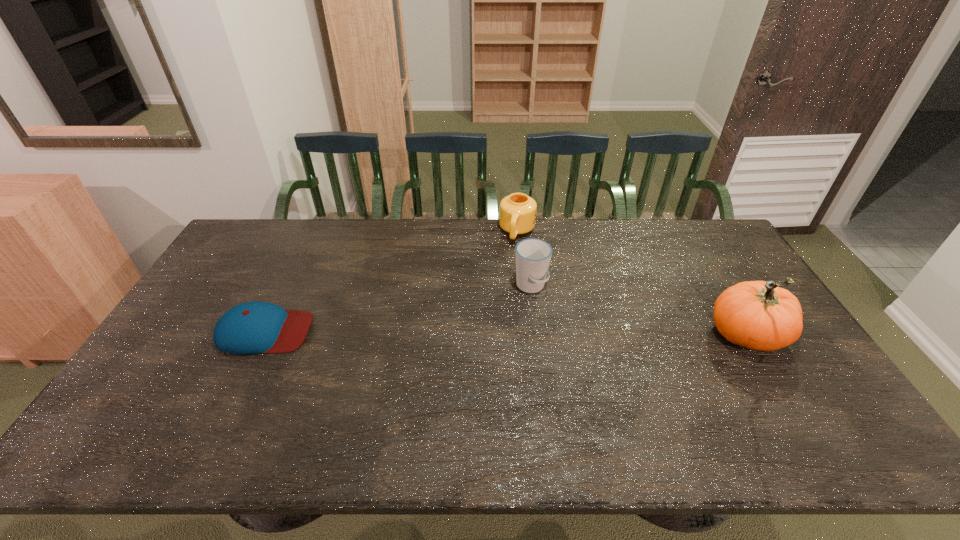
I want to click on free space between the mug and the pumpkin, so click(633, 284).

Find the location of a particular element. This screenshot has width=960, height=540. empty location between the third nearest object and the leftmost object is located at coordinates (397, 309).

Identify the location of free point between the shortest object and the tallest object. (506, 334).

In order to click on the second closest object to the pumpkin in this screenshot , I will do `click(517, 211)`.

Find the location of a particular element. The image size is (960, 540). object that is the second closest to the rightmost object is located at coordinates (517, 211).

The height and width of the screenshot is (540, 960). I want to click on free space in the image that satisfies the following two spatial constraints: 1. on the front side of the second farthest object; 2. on the right side of the pumpkin, so click(537, 336).

In order to click on free space that satisfies the following two spatial constraints: 1. on the front side of the mug; 2. on the right side of the third nearest object in this screenshot , I will do `click(523, 286)`.

Where is `blank area in the image that satisfies the following two spatial constraints: 1. on the front side of the farthest object; 2. on the right side of the third nearest object`? Image resolution: width=960 pixels, height=540 pixels. blank area in the image that satisfies the following two spatial constraints: 1. on the front side of the farthest object; 2. on the right side of the third nearest object is located at coordinates (523, 286).